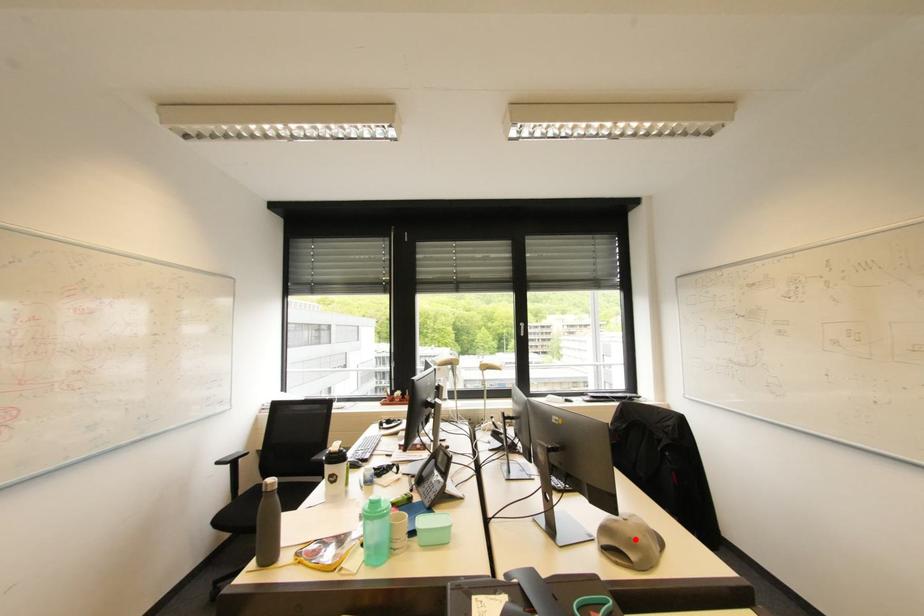
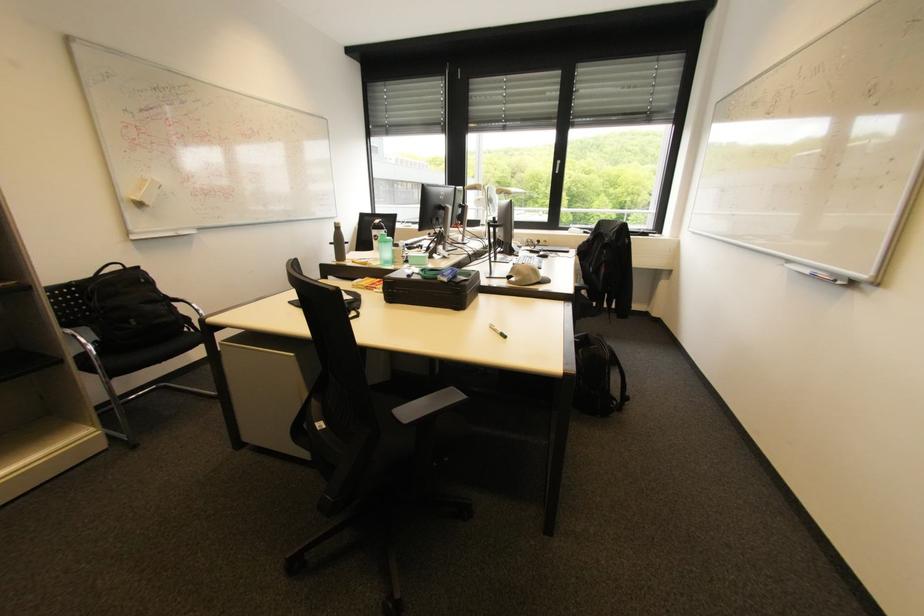
The point at the highlighted location is marked in the first image. Where is the corresponding point in the second image?

(524, 270)